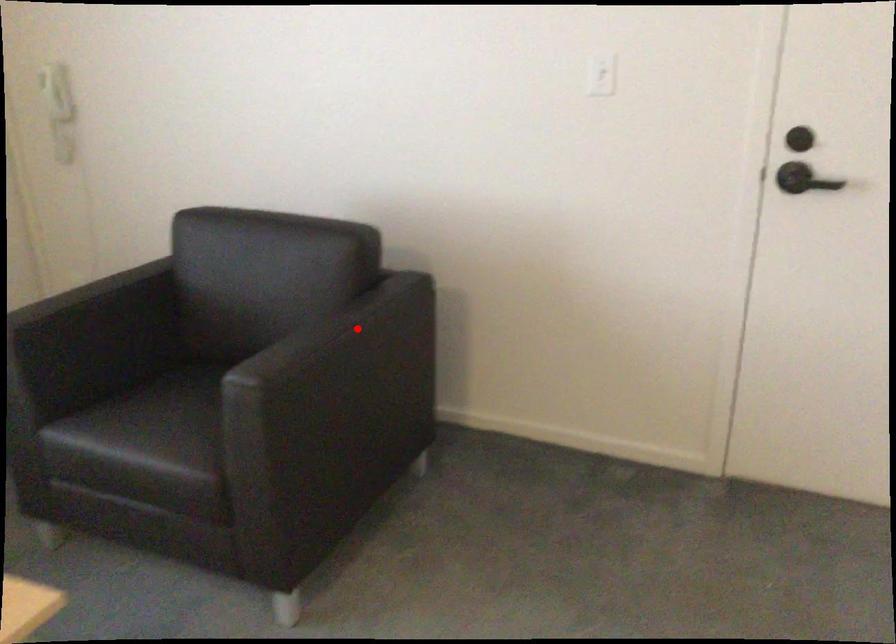
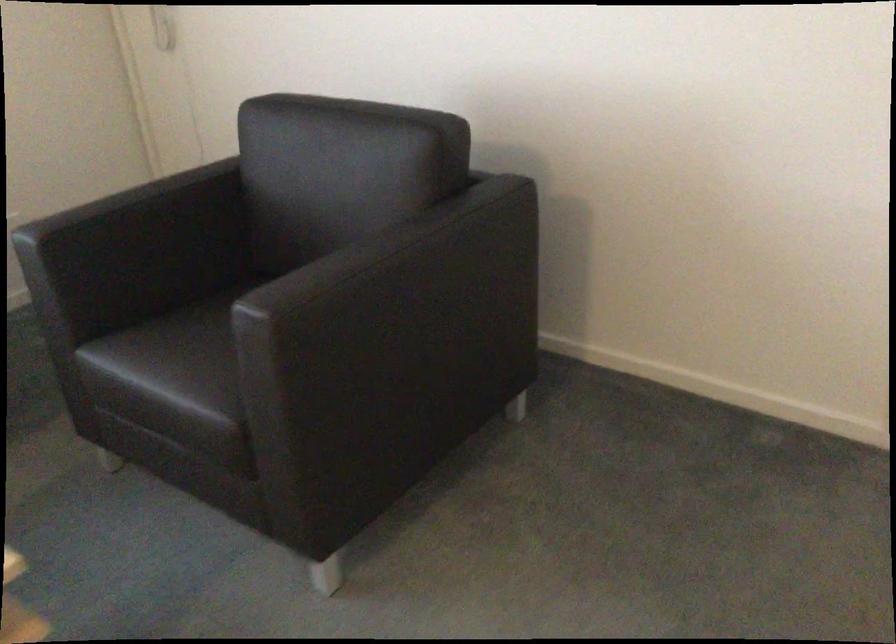
The point at the highlighted location is marked in the first image. Where is the corresponding point in the second image?

(419, 249)